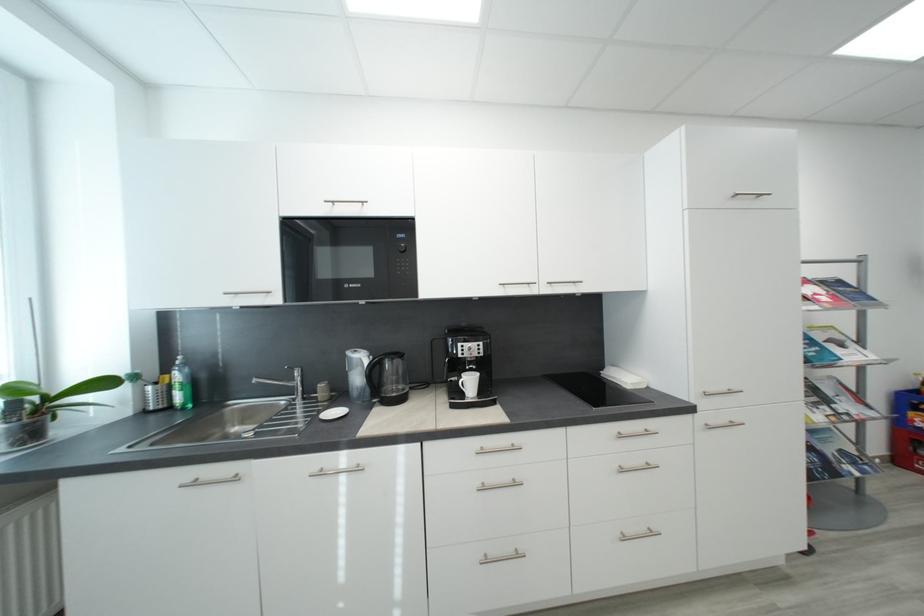
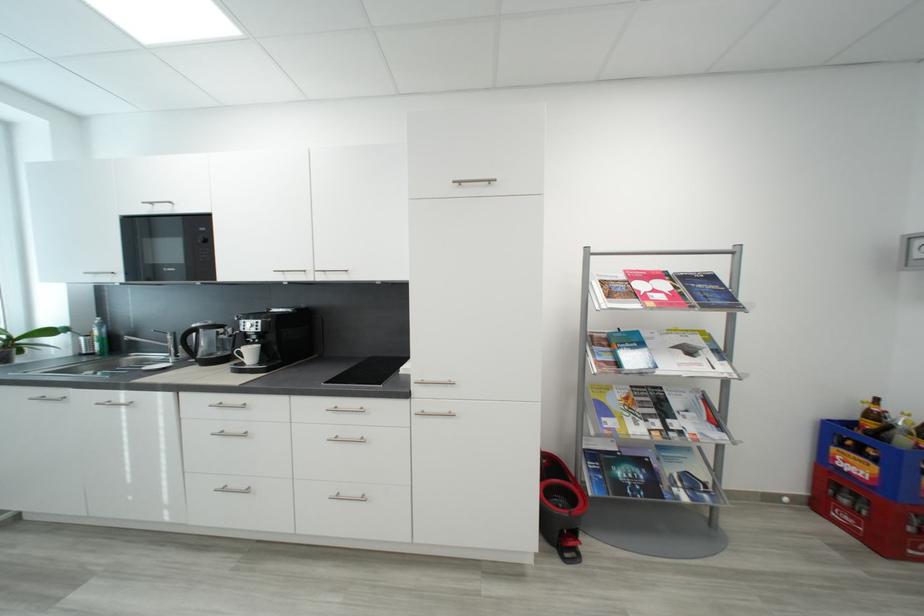
Where in the second image is the point corresponding to (x=177, y=410) from the first image?

(100, 355)